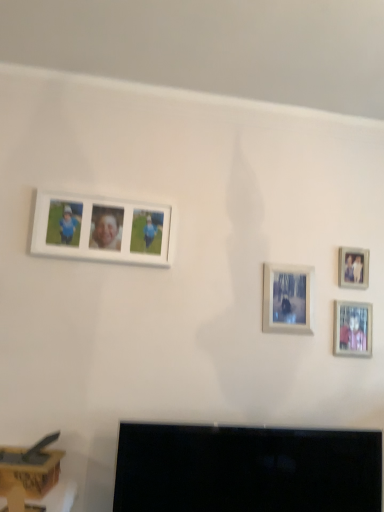
Question: In terms of size, does wooden photo frame at upper right, the first picture frame when ordered from right to left, appear bigger or smaller than matte silver photo frame at lower right, which is the 3th picture frame in left-to-right order?

Choices:
 (A) small
 (B) big

Answer: (A)

Question: From the image's perspective, relative to matte silver photo frame at lower right, which is the 3th picture frame in left-to-right order, is wooden photo frame at upper right, which appears as the 4th picture frame when viewed from the left, above or below?

Choices:
 (A) above
 (B) below

Answer: (A)

Question: Which of these objects is positioned farthest from the wooden photo frame at upper right, the first picture frame when ordered from right to left?

Choices:
 (A) white matte photo frame at upper left, which ranks as the 1th picture frame in left-to-right order
 (B) matte white picture frame at center, the 3th picture frame viewed from the right
 (C) matte silver photo frame at lower right, which is counted as the second picture frame, starting from the right
 (D) black glossy tv at lower center
 (E) wooden box at lower left

Answer: (E)

Question: Considering the real-world distances, which object is farthest from the wooden box at lower left?

Choices:
 (A) wooden photo frame at upper right, the first picture frame when ordered from right to left
 (B) matte silver photo frame at lower right, which is the 3th picture frame in left-to-right order
 (C) matte white picture frame at center, the 3th picture frame viewed from the right
 (D) black glossy tv at lower center
 (E) white matte photo frame at upper left, placed as the 4th picture frame when sorted from right to left

Answer: (A)